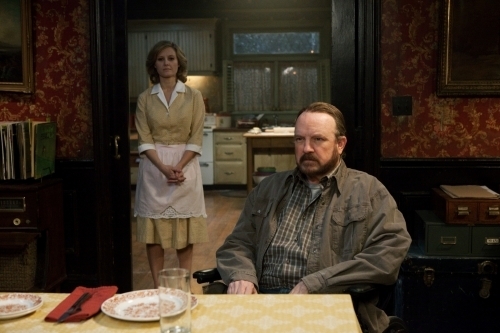
Identify the location of table. (301, 320).